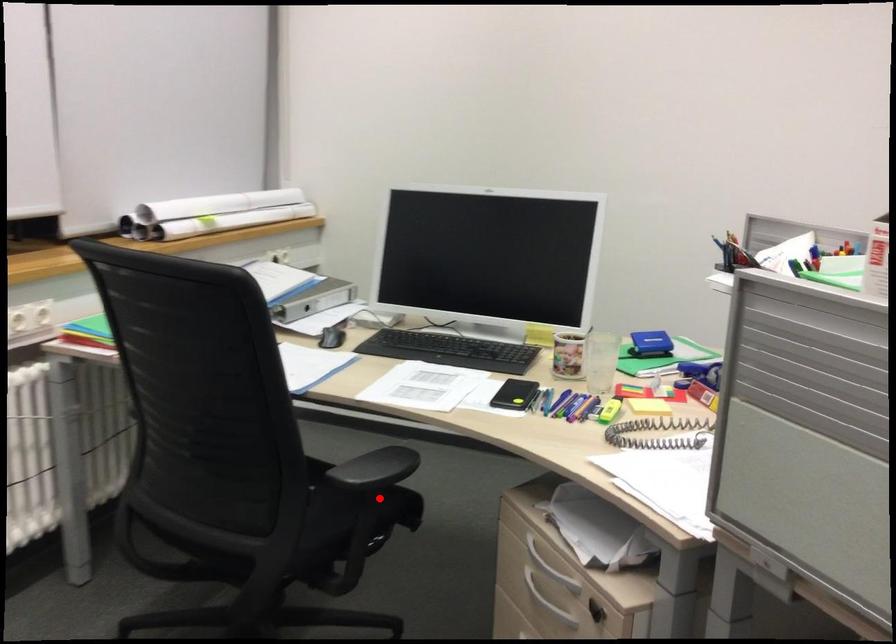
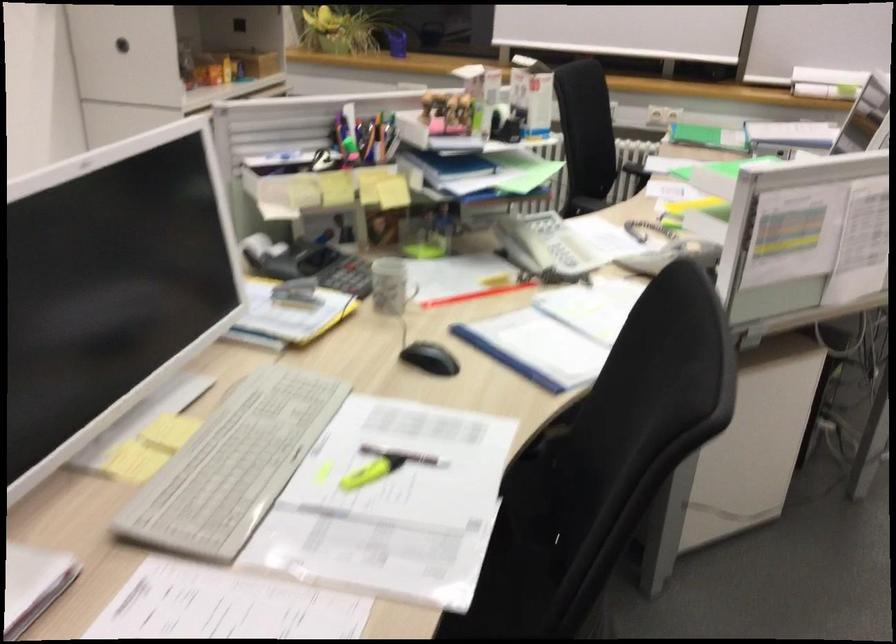
Question: I am providing you with two images of the same scene from different viewpoints. A red point is marked on the first image. Is the red point's position out of view in image 2?

Choices:
 (A) Yes
 (B) No

Answer: (A)